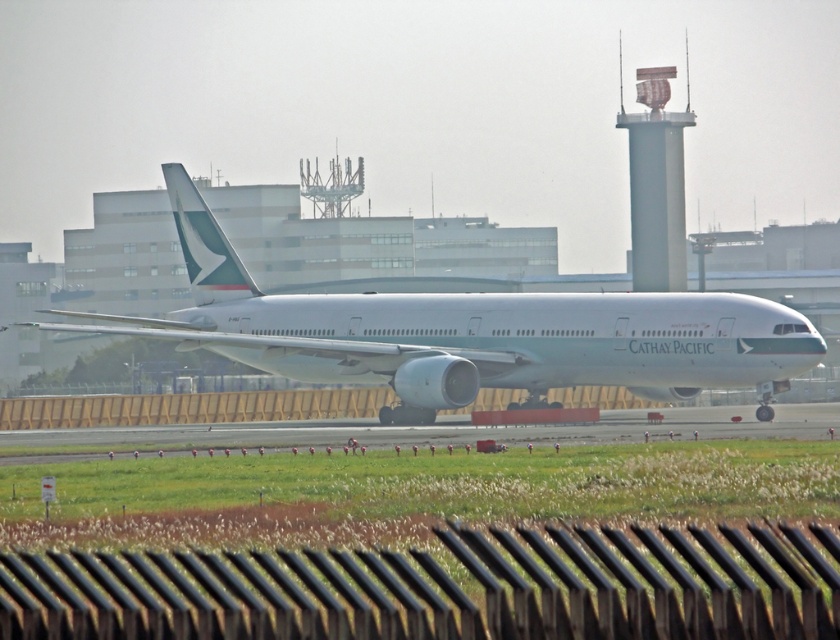
You are a pilot standing at the cockpit of the white glossy airplane at center. You want to taxi to the control tower. Can you safely taxi to the smooth gray control tower at upper right without any obstruction?

The white glossy airplane at center and smooth gray control tower at upper right are 40.96 feet apart. Since the distance between them is only 40.96 feet, the airplane cannot taxi to the control tower as they are too close to each other. Additionally, control towers are stationary structures, so the airplane would not be able to reach it by taxiing.

You are standing at the airport tarmac and want to reach the point marked as point (479, 321). If your walking speed is 1.5 meters per second, how long will it take you to reach that point?

The point (479, 321) is 60.91 meters away from the viewer. At a walking speed of 1.5 meters per second, it would take approximately 40.6 seconds to reach the point.

You are a pilot preparing for takeoff and you notice the white glossy airplane at center and the smooth gray control tower at upper right. Which object is closer to you based on their sizes?

The white glossy airplane at center has a smaller size compared to the smooth gray control tower at upper right, so the control tower is farther away and the airplane is closer.